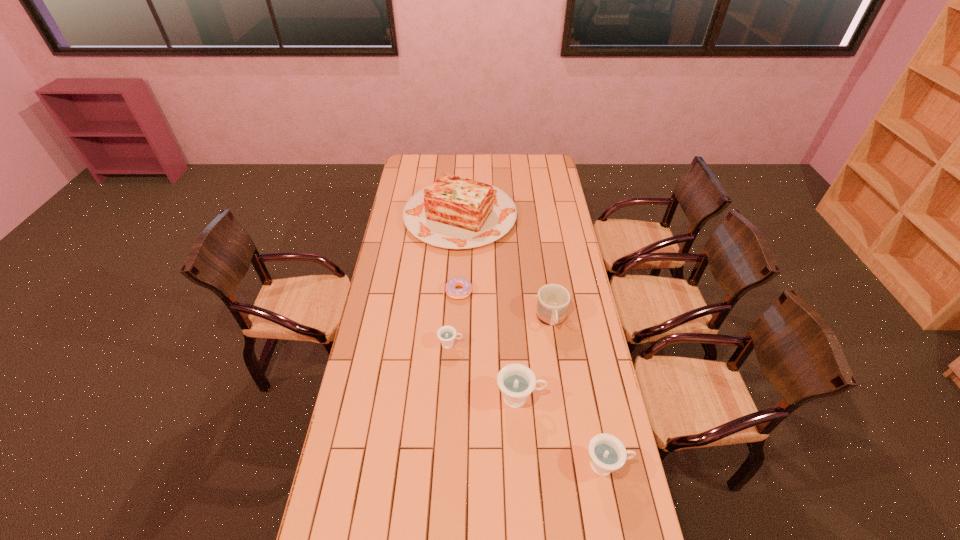
Find the location of `vacant place for an extra teacup on the left`. vacant place for an extra teacup on the left is located at coordinates (393, 299).